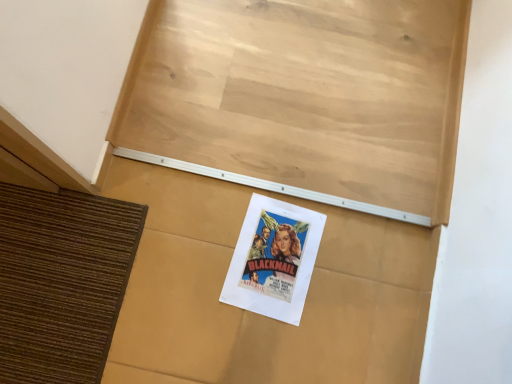
Where is `vacant space to the right of white paper poster at center`? vacant space to the right of white paper poster at center is located at coordinates (308, 269).